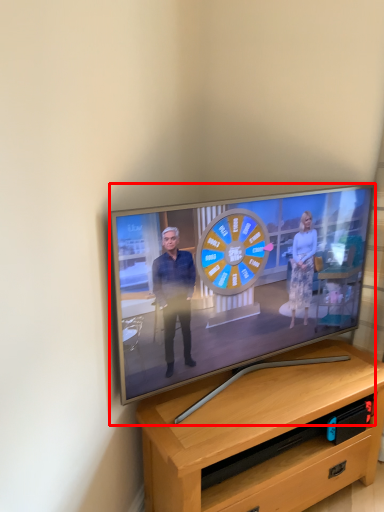
Question: Observing the image, what is the correct spatial positioning of television (annotated by the red box) in reference to desk?

Choices:
 (A) left
 (B) right

Answer: (A)